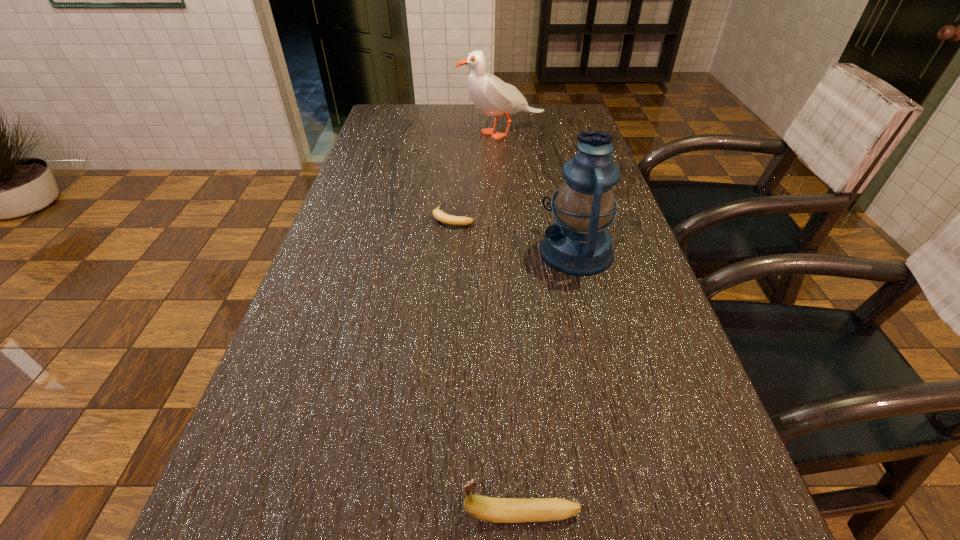
The width and height of the screenshot is (960, 540). I want to click on free space located 0.290m at the beak of the gull, so click(374, 133).

Where is `free space located at the beak of the gull`? Image resolution: width=960 pixels, height=540 pixels. free space located at the beak of the gull is located at coordinates (395, 133).

What are the coordinates of `vacant space situated at the stem of the nearer banana` in the screenshot? It's located at (415, 514).

Where is `vacant area situated 0.220m at the stem of the nearer banana`? vacant area situated 0.220m at the stem of the nearer banana is located at coordinates (308, 514).

What are the coordinates of `free spot located 0.120m at the stem of the nearer banana` in the screenshot? It's located at (379, 514).

I want to click on vacant space located on the left of the shorter banana, so click(x=352, y=217).

The height and width of the screenshot is (540, 960). Find the location of `object present at the far edge`. object present at the far edge is located at coordinates (492, 96).

I want to click on lantern at the right edge, so click(578, 243).

Where is `gull positioned at the right edge`? This screenshot has width=960, height=540. gull positioned at the right edge is located at coordinates coord(492,96).

The height and width of the screenshot is (540, 960). Identify the location of object positioned at the far right corner. (492, 96).